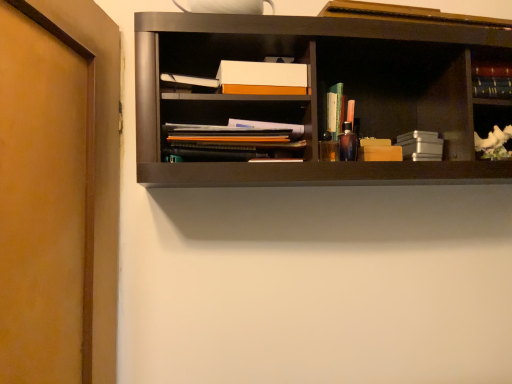
What do you see at coordinates (490, 79) in the screenshot?
I see `hardcover book at upper right, which appears as the first book when viewed from the right` at bounding box center [490, 79].

This screenshot has width=512, height=384. In order to click on brown matte door at left in this screenshot , I will do `click(45, 201)`.

Where is `metallic silver book at center-right, acting as the second book starting from the right`? The height and width of the screenshot is (384, 512). metallic silver book at center-right, acting as the second book starting from the right is located at coordinates (421, 145).

Describe the element at coordinates (335, 110) in the screenshot. The width and height of the screenshot is (512, 384). I see `translucent plastic pen holder at center, which appears as the 3th book when viewed from the right` at that location.

Locate an element on the screen. This screenshot has width=512, height=384. matte black notebook at center, which is counted as the 1th book, starting from the left is located at coordinates (236, 140).

Where is `white porcelain vase at right`? white porcelain vase at right is located at coordinates (493, 131).

Is metallic silver book at center-right, the third book positioned from the left, far from translucent plastic pen holder at center, which appears as the 3th book when viewed from the right?

That's not correct — metallic silver book at center-right, the third book positioned from the left, is a little close to translucent plastic pen holder at center, which appears as the 3th book when viewed from the right.

Can we say metallic silver book at center-right, the third book positioned from the left, lies outside translucent plastic pen holder at center, which appears as the 3th book when viewed from the right?

Indeed, metallic silver book at center-right, the third book positioned from the left, is completely outside translucent plastic pen holder at center, which appears as the 3th book when viewed from the right.

From the picture: Which of these two, metallic silver book at center-right, the third book positioned from the left, or translucent plastic pen holder at center, the second book positioned from the left, stands taller?

translucent plastic pen holder at center, the second book positioned from the left.

From a real-world perspective, is metallic silver book at center-right, acting as the second book starting from the right, below translucent plastic pen holder at center, which appears as the 3th book when viewed from the right?

Yes.

From a real-world perspective, is metallic silver book at center-right, acting as the second book starting from the right, under brown matte door at left?

No, from a real-world perspective, metallic silver book at center-right, acting as the second book starting from the right, is not under brown matte door at left.

Considering the positions of objects metallic silver book at center-right, the third book positioned from the left, and brown matte door at left in the image provided, who is in front, metallic silver book at center-right, the third book positioned from the left, or brown matte door at left?

Positioned in front is brown matte door at left.

Does point (402, 140) appear closer or farther from the camera than point (18, 90)?

Point (402, 140) is positioned farther from the camera compared to point (18, 90).

From a real-world perspective, is hardcover book at upper right, which appears as the first book when viewed from the right, physically below metallic silver book at center-right, the third book positioned from the left?

No, from a real-world perspective, hardcover book at upper right, which appears as the first book when viewed from the right, is not under metallic silver book at center-right, the third book positioned from the left.

Can you confirm if hardcover book at upper right, which appears as the first book when viewed from the right, is wider than metallic silver book at center-right, acting as the second book starting from the right?

Incorrect, the width of hardcover book at upper right, which appears as the first book when viewed from the right, does not surpass that of metallic silver book at center-right, acting as the second book starting from the right.

Is hardcover book at upper right, which appears as the fourth book when viewed from the left, bigger than metallic silver book at center-right, acting as the second book starting from the right?

Incorrect, hardcover book at upper right, which appears as the fourth book when viewed from the left, is not larger than metallic silver book at center-right, acting as the second book starting from the right.

Which is behind, hardcover book at upper right, which appears as the first book when viewed from the right, or metallic silver book at center-right, the third book positioned from the left?

metallic silver book at center-right, the third book positioned from the left.

Can you confirm if matte black notebook at center, which is counted as the 1th book, starting from the left, is taller than translucent plastic pen holder at center, the second book positioned from the left?

In fact, matte black notebook at center, which is counted as the 1th book, starting from the left, may be shorter than translucent plastic pen holder at center, the second book positioned from the left.

Is matte black notebook at center, which is counted as the 1th book, starting from the left, to the right of translucent plastic pen holder at center, the second book positioned from the left, from the viewer's perspective?

No.

From the image's perspective, who appears lower, translucent plastic pen holder at center, which appears as the 3th book when viewed from the right, or white porcelain vase at right?

white porcelain vase at right.

Is translucent plastic pen holder at center, the second book positioned from the left, to the right of white porcelain vase at right from the viewer's perspective?

In fact, translucent plastic pen holder at center, the second book positioned from the left, is to the left of white porcelain vase at right.

Which object is closer to the camera, translucent plastic pen holder at center, the second book positioned from the left, or white porcelain vase at right?

Positioned in front is white porcelain vase at right.

From a real-world perspective, which is physically below, brown matte door at left or matte black notebook at center, the fourth book in the right-to-left sequence?

From a 3D spatial view, brown matte door at left is below.

Would you say brown matte door at left contains matte black notebook at center, which is counted as the 1th book, starting from the left?

Definitely not — matte black notebook at center, which is counted as the 1th book, starting from the left, is not inside brown matte door at left.

How distant is brown matte door at left from matte black notebook at center, the fourth book in the right-to-left sequence?

brown matte door at left and matte black notebook at center, the fourth book in the right-to-left sequence, are 15.18 inches apart from each other.

How many degrees apart are the facing directions of brown matte door at left and matte black notebook at center, which is counted as the 1th book, starting from the left?

They differ by 104 degrees in their facing directions.

From a real-world perspective, is metallic silver book at center-right, the third book positioned from the left, above or below hardcover book at upper right, which appears as the first book when viewed from the right?

Clearly, from a real-world perspective, metallic silver book at center-right, the third book positioned from the left, is below hardcover book at upper right, which appears as the first book when viewed from the right.

Is metallic silver book at center-right, acting as the second book starting from the right, positioned far away from hardcover book at upper right, which appears as the fourth book when viewed from the left?

Actually, metallic silver book at center-right, acting as the second book starting from the right, and hardcover book at upper right, which appears as the fourth book when viewed from the left, are a little close together.

Locate an element on the screen. The width and height of the screenshot is (512, 384). the 3rd book above the metallic silver book at center-right, the third book positioned from the left (from the image's perspective) is located at coordinates (490, 79).

There is a translucent plastic pen holder at center, which appears as the 3th book when viewed from the right. Identify the location of the 2nd book below it (from a real-world perspective). This screenshot has width=512, height=384. pos(421,145).

You are a GUI agent. You are given a task and a screenshot of the screen. Output one action in this format:
    pyautogui.click(x=<x>, y=<y>)
    Task: Click on the 1st book directly above the brown matte door at left (from a real-world perspective)
    Image resolution: width=512 pixels, height=384 pixels.
    Given the screenshot: What is the action you would take?
    pyautogui.click(x=421, y=145)

Based on their spatial positions, is matte black notebook at center, the fourth book in the right-to-left sequence, or white porcelain vase at right closer to translucent plastic pen holder at center, which appears as the 3th book when viewed from the right?

matte black notebook at center, the fourth book in the right-to-left sequence, is positioned closer to the anchor translucent plastic pen holder at center, which appears as the 3th book when viewed from the right.

Looking at the image, which one is located further to metallic silver book at center-right, acting as the second book starting from the right, hardcover book at upper right, which appears as the fourth book when viewed from the left, or translucent plastic pen holder at center, which appears as the 3th book when viewed from the right?

translucent plastic pen holder at center, which appears as the 3th book when viewed from the right.

Looking at the image, which one is located further to translucent plastic pen holder at center, which appears as the 3th book when viewed from the right, white porcelain vase at right or brown matte door at left?

brown matte door at left lies further to translucent plastic pen holder at center, which appears as the 3th book when viewed from the right, than the other object.

Which object lies nearer to the anchor point translucent plastic pen holder at center, the second book positioned from the left, hardcover book at upper right, which appears as the first book when viewed from the right, or white porcelain vase at right?

Among the two, hardcover book at upper right, which appears as the first book when viewed from the right, is located nearer to translucent plastic pen holder at center, the second book positioned from the left.

From the image, which object appears to be nearer to hardcover book at upper right, which appears as the first book when viewed from the right, translucent plastic pen holder at center, which appears as the 3th book when viewed from the right, or brown matte door at left?

translucent plastic pen holder at center, which appears as the 3th book when viewed from the right.

Which object lies further to the anchor point brown matte door at left, hardcover book at upper right, which appears as the fourth book when viewed from the left, or translucent plastic pen holder at center, the second book positioned from the left?

hardcover book at upper right, which appears as the fourth book when viewed from the left, is positioned further to the anchor brown matte door at left.

Estimate the real-world distances between objects in this image. Which object is closer to translucent plastic pen holder at center, the second book positioned from the left, hardcover book at upper right, which appears as the first book when viewed from the right, or matte black notebook at center, the fourth book in the right-to-left sequence?

matte black notebook at center, the fourth book in the right-to-left sequence, is closer to translucent plastic pen holder at center, the second book positioned from the left.

In the scene shown: Considering their positions, is translucent plastic pen holder at center, which appears as the 3th book when viewed from the right, positioned closer to white porcelain vase at right than metallic silver book at center-right, acting as the second book starting from the right?

metallic silver book at center-right, acting as the second book starting from the right.

This screenshot has width=512, height=384. I want to click on cabinet between translucent plastic pen holder at center, the second book positioned from the left, and hardcover book at upper right, which appears as the first book when viewed from the right, in the horizontal direction, so click(x=493, y=131).

Find the location of `cabinet between hardcover book at upper right, which appears as the fourth book when viewed from the left, and metallic silver book at center-right, the third book positioned from the left, in the vertical direction`. cabinet between hardcover book at upper right, which appears as the fourth book when viewed from the left, and metallic silver book at center-right, the third book positioned from the left, in the vertical direction is located at coordinates (493, 131).

Image resolution: width=512 pixels, height=384 pixels. Identify the location of book between translucent plastic pen holder at center, the second book positioned from the left, and hardcover book at upper right, which appears as the fourth book when viewed from the left, in the horizontal direction. (421, 145).

In order to click on cabinet situated between brown matte door at left and hardcover book at upper right, which appears as the fourth book when viewed from the left, from left to right in this screenshot , I will do click(493, 131).